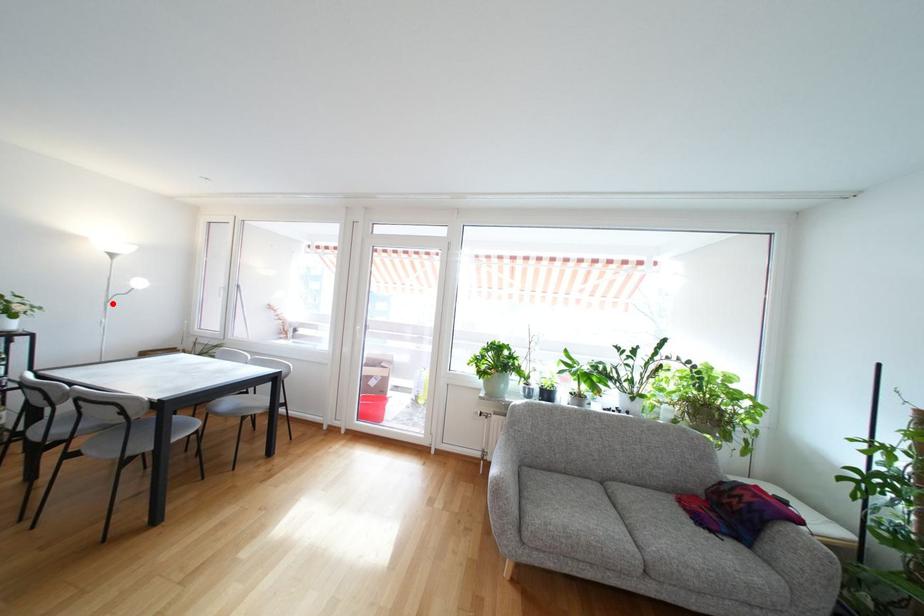
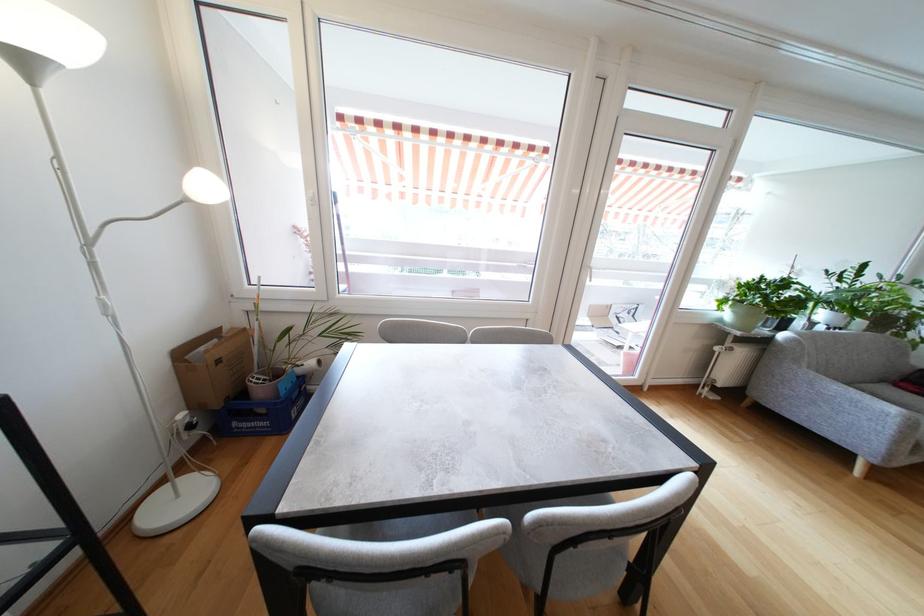
The point at the highlighted location is marked in the first image. Where is the corresponding point in the second image?

(93, 246)